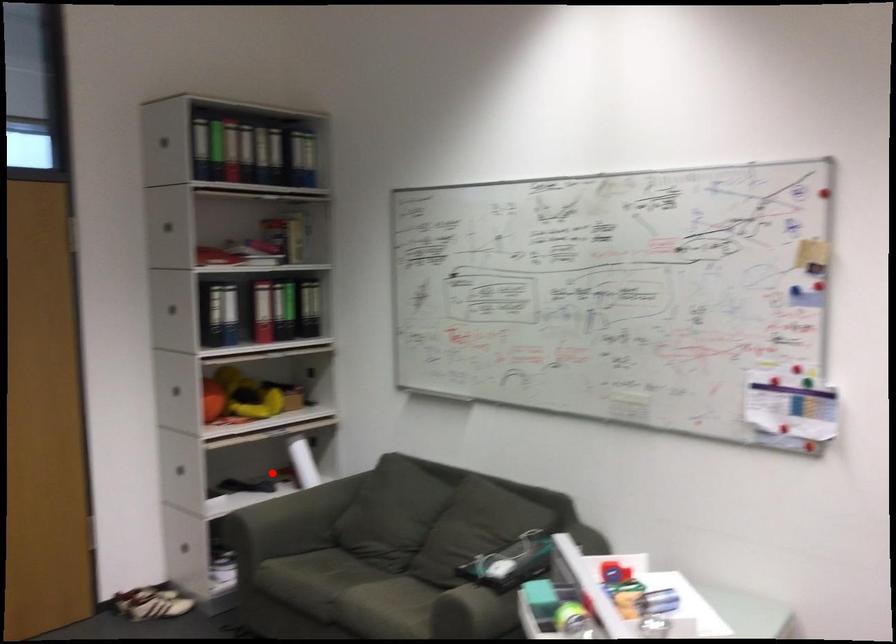
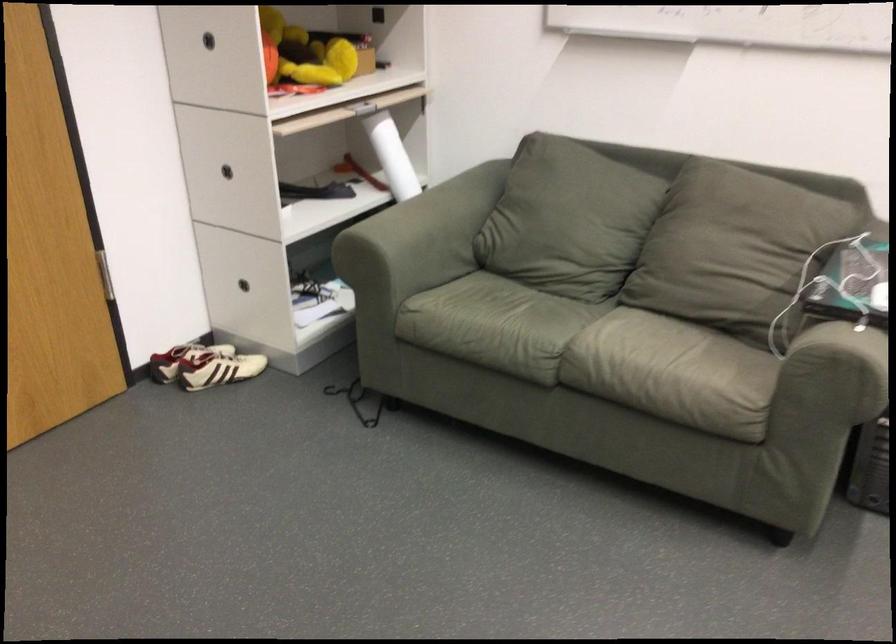
Question: I am providing you with two images of the same scene from different viewpoints. A red point is marked on the first image. Is the red point's position out of view in image 2?

Choices:
 (A) Yes
 (B) No

Answer: (B)